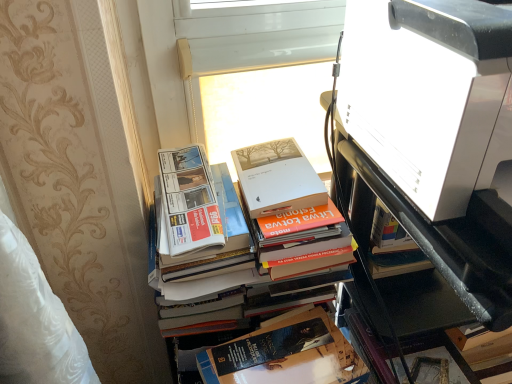
Question: Is white glossy printer at upper right beside white glossy printer at upper right?

Choices:
 (A) yes
 (B) no

Answer: (B)

Question: Can you confirm if white glossy printer at upper right is shorter than white glossy printer at upper right?

Choices:
 (A) no
 (B) yes

Answer: (A)

Question: Considering the relative sizes of white glossy printer at upper right and white glossy printer at upper right in the image provided, is white glossy printer at upper right wider than white glossy printer at upper right?

Choices:
 (A) yes
 (B) no

Answer: (A)

Question: Does white glossy printer at upper right contain white glossy printer at upper right?

Choices:
 (A) no
 (B) yes

Answer: (A)

Question: Considering the relative sizes of white glossy printer at upper right and white glossy printer at upper right in the image provided, is white glossy printer at upper right smaller than white glossy printer at upper right?

Choices:
 (A) yes
 (B) no

Answer: (B)

Question: In terms of width, does white plastic window screen at upper center look wider or thinner when compared to hardcover book at center?

Choices:
 (A) thin
 (B) wide

Answer: (A)

Question: Does point (287, 82) appear closer or farther from the camera than point (335, 332)?

Choices:
 (A) farther
 (B) closer

Answer: (A)

Question: Considering their positions, is white plastic window screen at upper center located in front of or behind hardcover book at center?

Choices:
 (A) behind
 (B) front

Answer: (A)

Question: From the image's perspective, relative to hardcover book at center, is white plastic window screen at upper center above or below?

Choices:
 (A) below
 (B) above

Answer: (B)

Question: Considering the positions of point (340, 342) and point (385, 19), is point (340, 342) closer or farther from the camera than point (385, 19)?

Choices:
 (A) closer
 (B) farther

Answer: (B)

Question: From a real-world perspective, is hardcover book at center physically located above or below white glossy printer at upper right?

Choices:
 (A) above
 (B) below

Answer: (B)

Question: Would you say hardcover book at center is inside or outside white glossy printer at upper right?

Choices:
 (A) inside
 (B) outside

Answer: (B)

Question: Considering their positions, is hardcover book at center located in front of or behind white glossy printer at upper right?

Choices:
 (A) behind
 (B) front

Answer: (A)

Question: Considering the positions of white plastic window screen at upper center and white glossy printer at upper right in the image, is white plastic window screen at upper center wider or thinner than white glossy printer at upper right?

Choices:
 (A) thin
 (B) wide

Answer: (A)

Question: Based on their positions, is white plastic window screen at upper center located to the left or right of white glossy printer at upper right?

Choices:
 (A) right
 (B) left

Answer: (B)